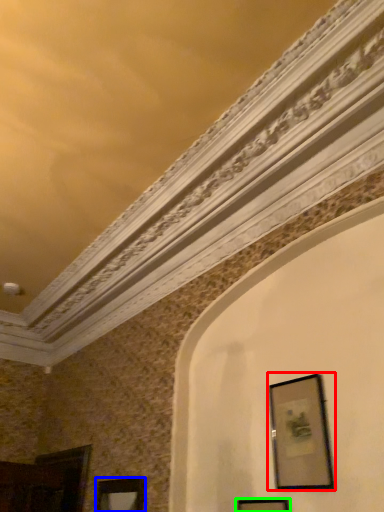
Question: Estimate the real-world distances between objects in this image. Which object is farther from picture frame (highlighted by a red box), picture frame (highlighted by a blue box) or picture frame (highlighted by a green box)?

Choices:
 (A) picture frame
 (B) picture frame

Answer: (A)